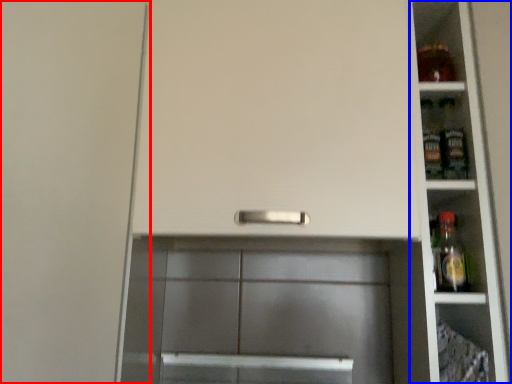
Question: Which of the following is the farthest to the observer, door (highlighted by a red box) or shelf (highlighted by a blue box)?

Choices:
 (A) door
 (B) shelf

Answer: (B)